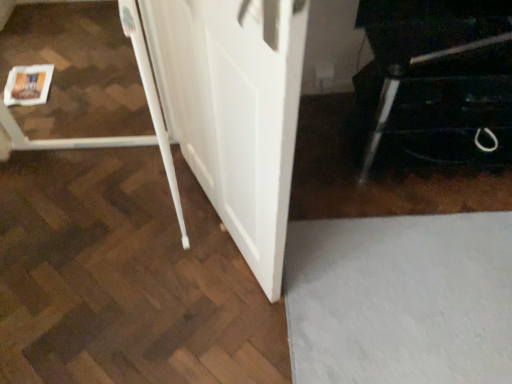
Question: Considering the positions of point (449, 104) and point (185, 82), is point (449, 104) closer or farther from the camera than point (185, 82)?

Choices:
 (A) closer
 (B) farther

Answer: (B)

Question: From a real-world perspective, is black glossy cabinet at lower right physically located above or below white matte barn door at center?

Choices:
 (A) below
 (B) above

Answer: (A)

Question: Choose the correct answer: Is black glossy cabinet at lower right inside white matte barn door at center or outside it?

Choices:
 (A) inside
 (B) outside

Answer: (B)

Question: Is point (290, 135) closer or farther from the camera than point (468, 127)?

Choices:
 (A) closer
 (B) farther

Answer: (A)

Question: From the image's perspective, is white matte barn door at center above or below black glossy cabinet at lower right?

Choices:
 (A) above
 (B) below

Answer: (B)

Question: From a real-world perspective, is white matte barn door at center above or below black glossy cabinet at lower right?

Choices:
 (A) below
 (B) above

Answer: (B)

Question: In the image, is white matte barn door at center positioned in front of or behind black glossy cabinet at lower right?

Choices:
 (A) front
 (B) behind

Answer: (A)